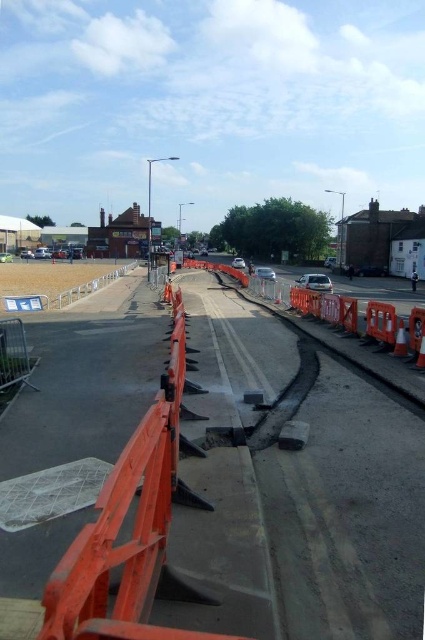
Is orange plastic barrier at center to the right of orange plastic traffic cone at right from the viewer's perspective?

Incorrect, orange plastic barrier at center is not on the right side of orange plastic traffic cone at right.

In the scene shown: Can you confirm if orange plastic barrier at center is positioned above orange plastic traffic cone at right?

No, orange plastic barrier at center is not above orange plastic traffic cone at right.

The image size is (425, 640). Identify the location of orange plastic barrier at center. (292, 492).